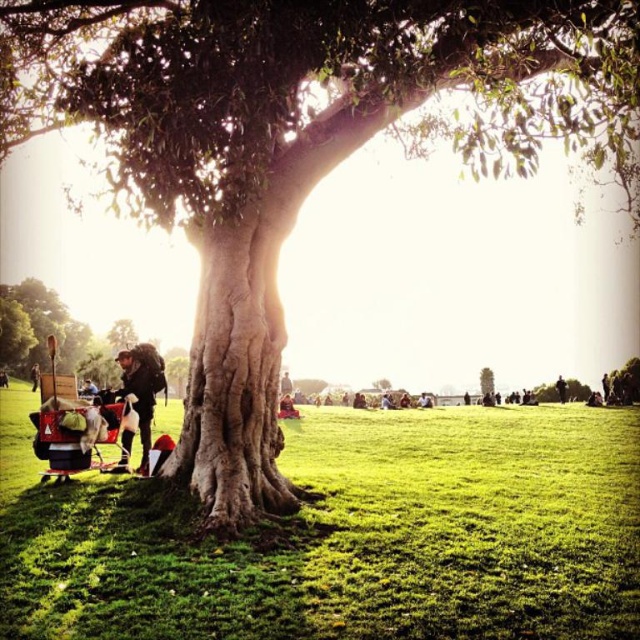
You are planning to set up a small tent in the park. You have a tent that requires a flat area with grass height no taller than the matte black backpack at left. Based on the scene, is the green grass at lower left suitable for setting up the tent?

→ The green grass at lower left has a lesser height compared to the matte black backpack at left, so it is suitable for setting up the tent since its grass height meets the requirement of being no taller than the backpack.